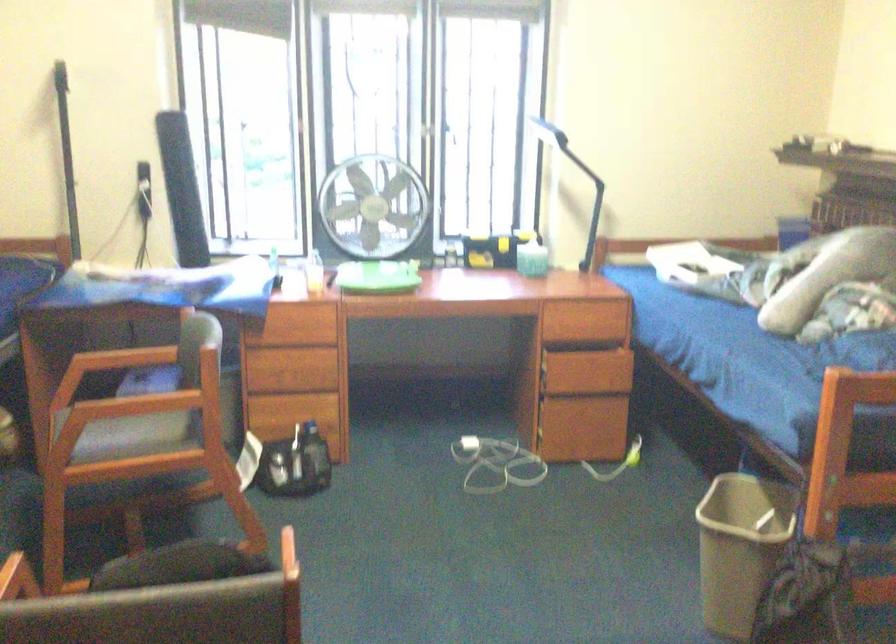
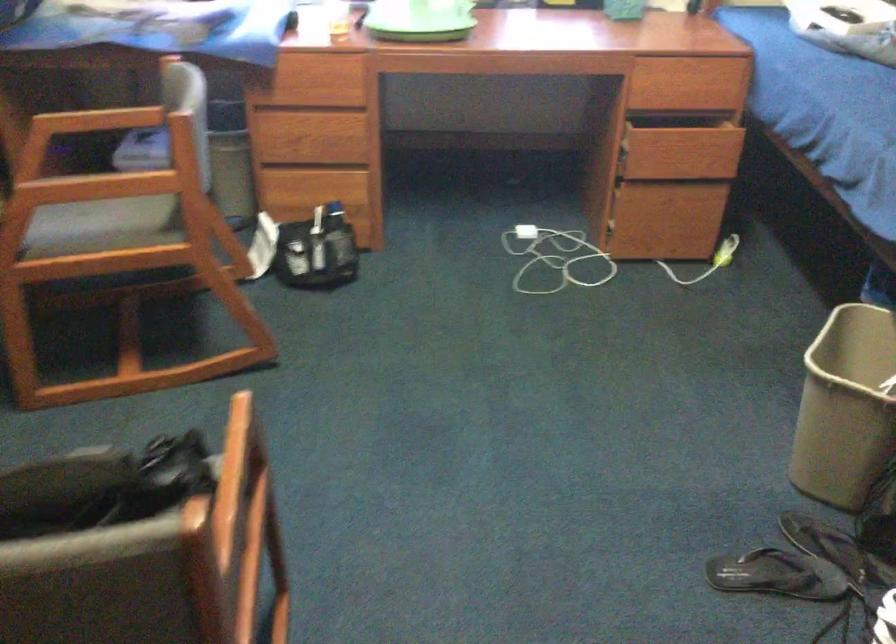
Question: In a continuous first-person perspective shot, in which direction is the camera moving?

Choices:
 (A) Left
 (B) Right
 (C) Forward
 (D) Backward

Answer: (C)